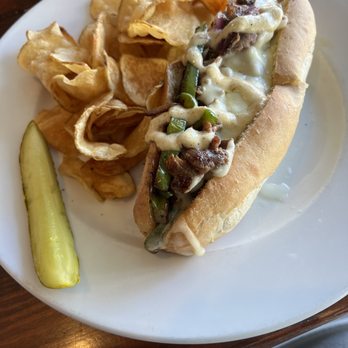
The image size is (348, 348). I want to click on white plate, so click(x=318, y=227).